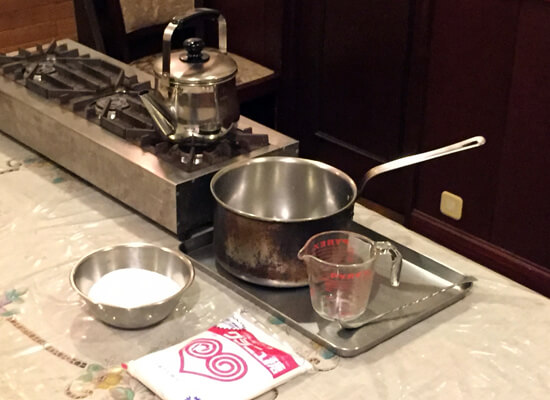
The width and height of the screenshot is (550, 400). I want to click on table, so click(x=256, y=84).